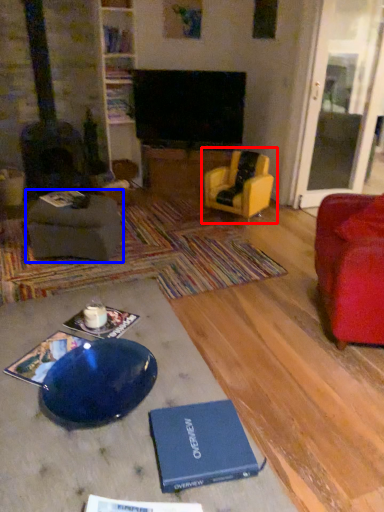
Question: Which point is further to the camera, chair (highlighted by a red box) or footrest (highlighted by a blue box)?

Choices:
 (A) chair
 (B) footrest

Answer: (A)